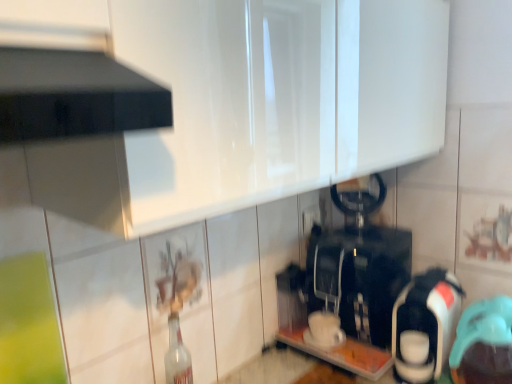
Question: Would you say black plastic coffee machine at center, arranged as the 3th appliance when viewed from the right, is part of teal rubber cap at lower right, positioned as the 1th appliance in right-to-left order,'s contents?

Choices:
 (A) no
 (B) yes

Answer: (A)

Question: Considering the relative positions of teal rubber cap at lower right, which is the 3th appliance in left-to-right order, and black plastic coffee machine at center, the first appliance viewed from the left, in the image provided, is teal rubber cap at lower right, which is the 3th appliance in left-to-right order, to the right of black plastic coffee machine at center, the first appliance viewed from the left, from the viewer's perspective?

Choices:
 (A) no
 (B) yes

Answer: (B)

Question: From the image's perspective, is teal rubber cap at lower right, positioned as the 1th appliance in right-to-left order, above black plastic coffee machine at center, the first appliance viewed from the left?

Choices:
 (A) no
 (B) yes

Answer: (A)

Question: Does teal rubber cap at lower right, positioned as the 1th appliance in right-to-left order, have a lesser width compared to black plastic coffee machine at center, the first appliance viewed from the left?

Choices:
 (A) yes
 (B) no

Answer: (A)

Question: Is teal rubber cap at lower right, positioned as the 1th appliance in right-to-left order, facing towards black plastic coffee machine at center, the first appliance viewed from the left?

Choices:
 (A) yes
 (B) no

Answer: (B)

Question: In terms of height, does white glossy coffee maker at right, which is the 2th appliance from right to left, look taller or shorter compared to teal rubber cap at lower right, positioned as the 1th appliance in right-to-left order?

Choices:
 (A) short
 (B) tall

Answer: (B)

Question: Is white glossy coffee maker at right, which ranks as the second appliance in left-to-right order, in front of or behind teal rubber cap at lower right, which is the 3th appliance in left-to-right order, in the image?

Choices:
 (A) behind
 (B) front

Answer: (A)

Question: In the image, is white glossy coffee maker at right, which ranks as the second appliance in left-to-right order, on the left side or the right side of teal rubber cap at lower right, which is the 3th appliance in left-to-right order?

Choices:
 (A) left
 (B) right

Answer: (A)

Question: Considering the positions of white glossy coffee maker at right, which is the 2th appliance from right to left, and teal rubber cap at lower right, which is the 3th appliance in left-to-right order, in the image, is white glossy coffee maker at right, which is the 2th appliance from right to left, bigger or smaller than teal rubber cap at lower right, which is the 3th appliance in left-to-right order,?

Choices:
 (A) big
 (B) small

Answer: (A)

Question: From the image's perspective, is teal rubber cap at lower right, which is the 3th appliance in left-to-right order, positioned above or below white glossy coffee maker at right, which ranks as the second appliance in left-to-right order?

Choices:
 (A) above
 (B) below

Answer: (B)

Question: Would you say teal rubber cap at lower right, positioned as the 1th appliance in right-to-left order, is inside or outside white glossy coffee maker at right, which is the 2th appliance from right to left?

Choices:
 (A) outside
 (B) inside

Answer: (A)

Question: Relative to white glossy coffee maker at right, which is the 2th appliance from right to left, is teal rubber cap at lower right, which is the 3th appliance in left-to-right order, in front or behind?

Choices:
 (A) front
 (B) behind

Answer: (A)

Question: From their relative heights in the image, would you say teal rubber cap at lower right, positioned as the 1th appliance in right-to-left order, is taller or shorter than white glossy coffee maker at right, which is the 2th appliance from right to left?

Choices:
 (A) short
 (B) tall

Answer: (A)

Question: Based on their positions, is black plastic coffee machine at center, the first appliance viewed from the left, located to the left or right of teal rubber cap at lower right, which is the 3th appliance in left-to-right order?

Choices:
 (A) right
 (B) left

Answer: (B)

Question: Is black plastic coffee machine at center, the first appliance viewed from the left, taller or shorter than teal rubber cap at lower right, which is the 3th appliance in left-to-right order?

Choices:
 (A) short
 (B) tall

Answer: (B)